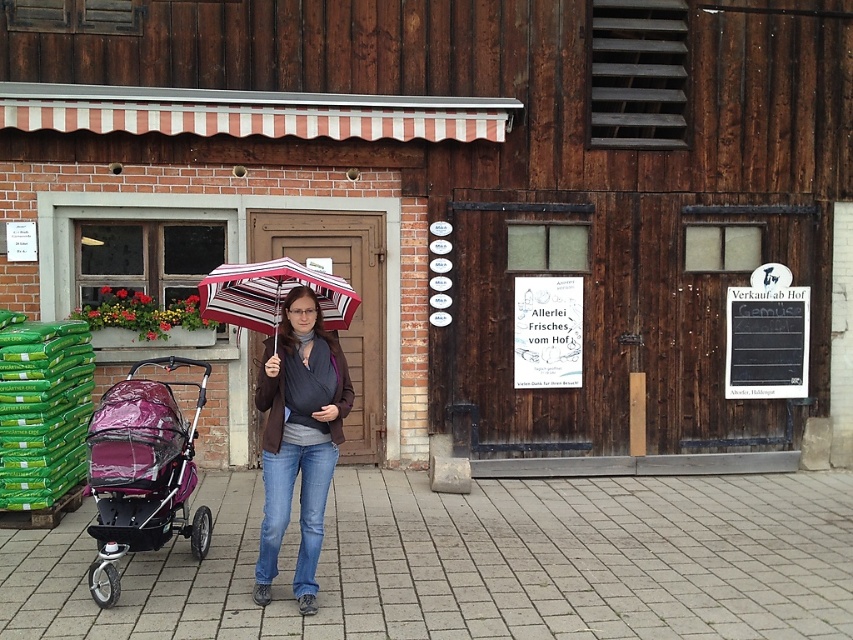
Between gray concrete pavement at center and striped fabric umbrella at center, which one is positioned higher?

striped fabric umbrella at center is above.

Between gray concrete pavement at center and striped fabric umbrella at center, which one appears on the right side from the viewer's perspective?

gray concrete pavement at center is more to the right.

At what (x,y) coordinates should I click in order to perform the action: click on gray concrete pavement at center. Please return your answer as a coordinate pair (x, y). The image size is (853, 640). Looking at the image, I should click on (474, 563).

In order to click on gray concrete pavement at center in this screenshot , I will do `click(474, 563)`.

Can you confirm if gray concrete pavement at center is taller than black chalkboard at right?

Incorrect, gray concrete pavement at center's height is not larger of black chalkboard at right's.

Who is more distant from viewer, [793,515] or [766,362]?

Positioned behind is point [766,362].

Which is in front, point (537, 484) or point (808, 339)?

Point (537, 484) is more forward.

Identify the location of gray concrete pavement at center. (474, 563).

Which is above, purple glossy baby carriage at left or striped fabric umbrella at center?

Positioned higher is striped fabric umbrella at center.

This screenshot has width=853, height=640. What are the coordinates of `purple glossy baby carriage at left` in the screenshot? It's located at (141, 472).